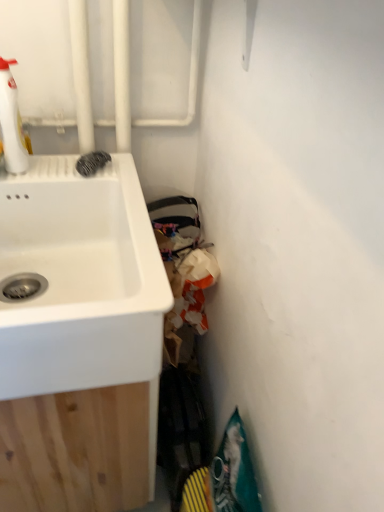
Question: Is white glossy spray bottle at upper left shorter than white matte sink at left?

Choices:
 (A) yes
 (B) no

Answer: (A)

Question: Considering the relative sizes of white glossy spray bottle at upper left and white matte sink at left in the image provided, is white glossy spray bottle at upper left taller than white matte sink at left?

Choices:
 (A) no
 (B) yes

Answer: (A)

Question: From a real-world perspective, is white glossy spray bottle at upper left on white matte sink at left?

Choices:
 (A) yes
 (B) no

Answer: (A)

Question: Is white glossy spray bottle at upper left wider than white matte sink at left?

Choices:
 (A) no
 (B) yes

Answer: (A)

Question: Is white glossy spray bottle at upper left outside of white matte sink at left?

Choices:
 (A) no
 (B) yes

Answer: (B)

Question: Is white glossy spray bottle at upper left positioned far away from white matte sink at left?

Choices:
 (A) no
 (B) yes

Answer: (A)

Question: Does white matte sink at left come in front of white glossy spray bottle at upper left?

Choices:
 (A) yes
 (B) no

Answer: (A)

Question: Is white matte sink at left positioned with its back to white glossy spray bottle at upper left?

Choices:
 (A) yes
 (B) no

Answer: (B)

Question: From the image's perspective, is white matte sink at left on top of white glossy spray bottle at upper left?

Choices:
 (A) yes
 (B) no

Answer: (B)

Question: From the image's perspective, is white matte sink at left beneath white glossy spray bottle at upper left?

Choices:
 (A) yes
 (B) no

Answer: (A)

Question: Does white matte sink at left have a lesser height compared to white glossy spray bottle at upper left?

Choices:
 (A) yes
 (B) no

Answer: (B)

Question: Does white matte sink at left appear on the left side of white glossy spray bottle at upper left?

Choices:
 (A) no
 (B) yes

Answer: (A)

Question: Is white glossy spray bottle at upper left wider or thinner than white matte sink at left?

Choices:
 (A) wide
 (B) thin

Answer: (B)